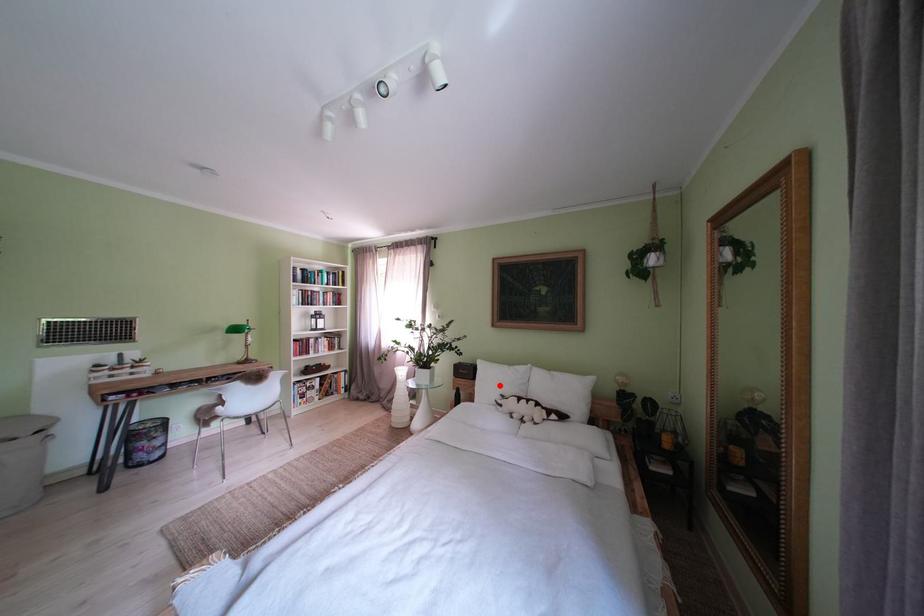
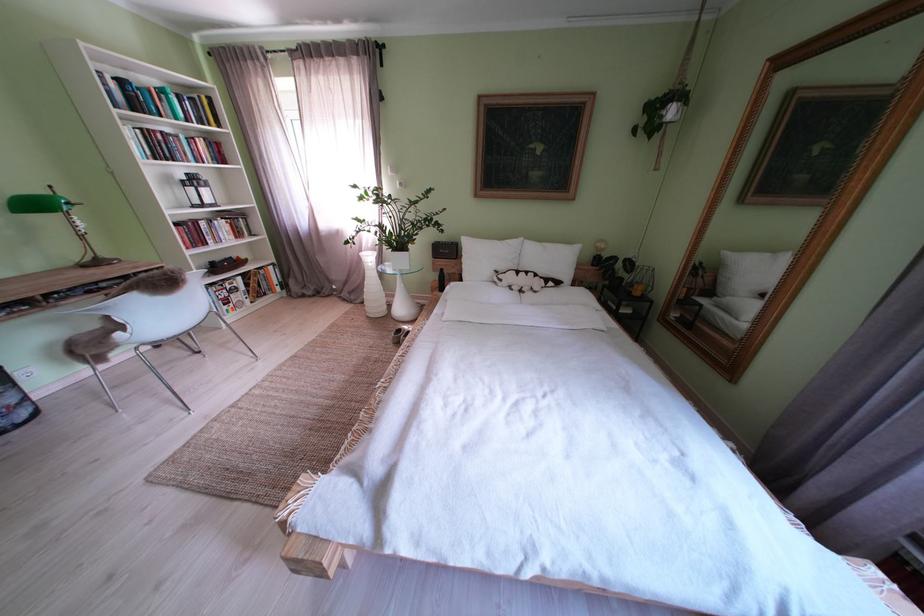
In the second image, find the point that corresponds to the highlighted location in the first image.

(490, 262)